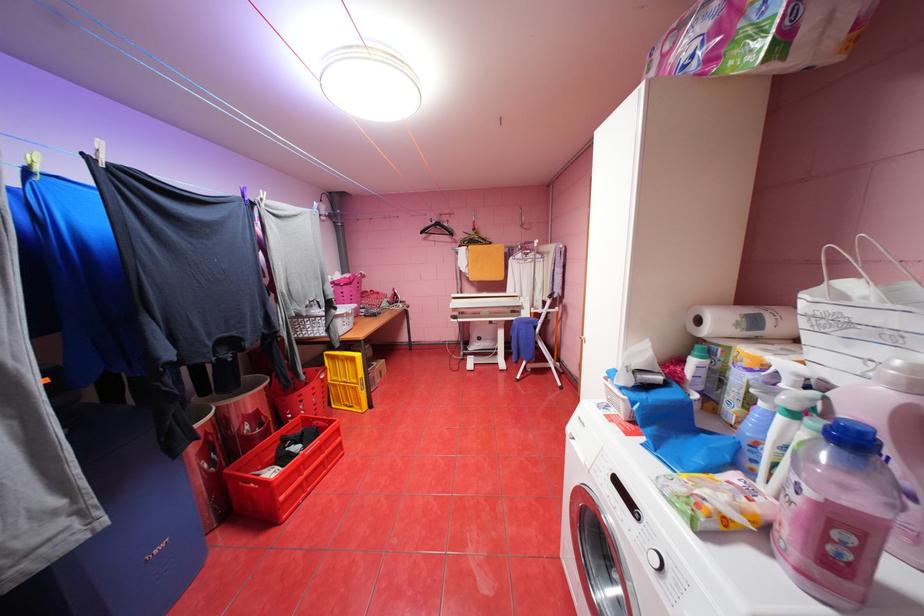
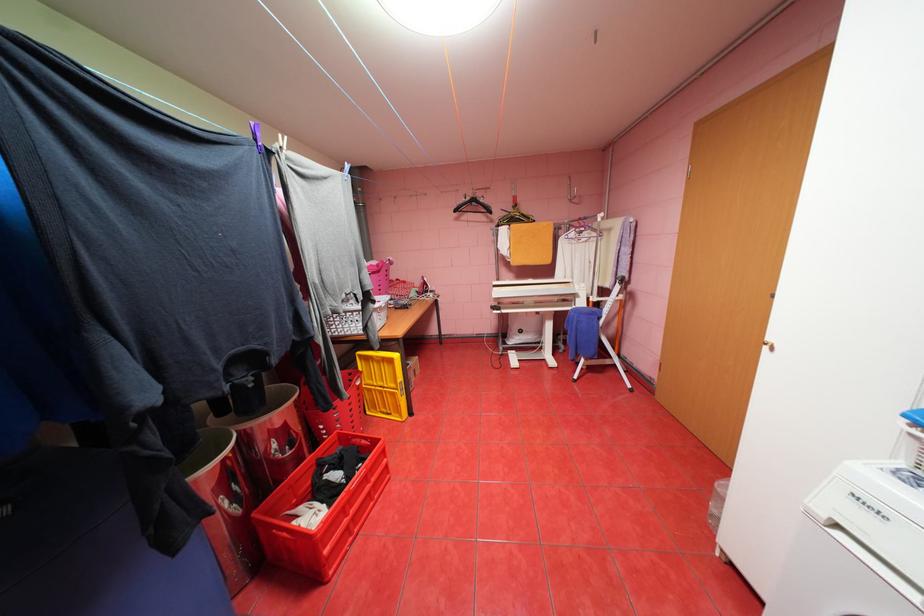
The point at (336,355) is marked in the first image. Where is the corresponding point in the second image?

(370, 355)